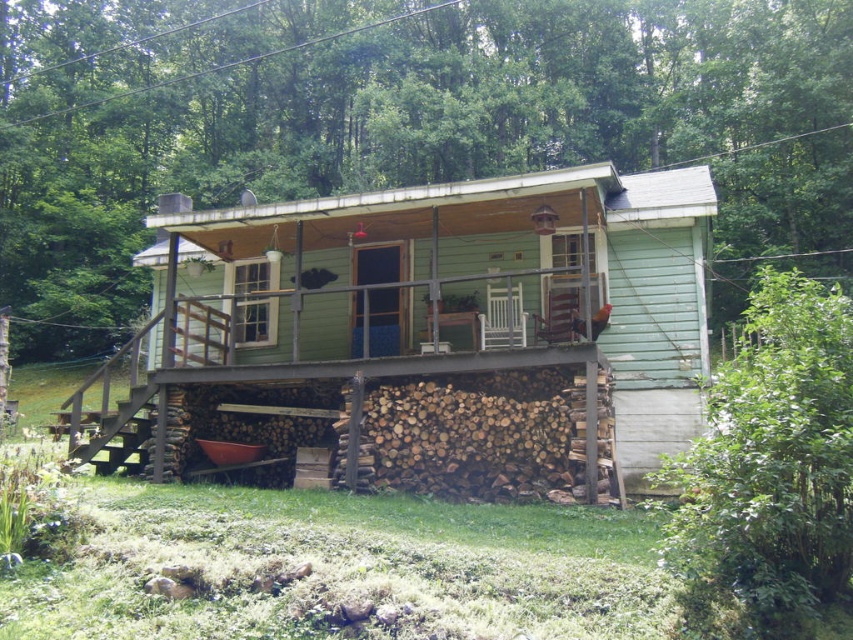
Question: Does green wooden cabin at center appear over green wooden porch at center?

Choices:
 (A) yes
 (B) no

Answer: (B)

Question: Does green wooden cabin at center lie in front of green wooden porch at center?

Choices:
 (A) yes
 (B) no

Answer: (B)

Question: Which object is farther from the camera taking this photo?

Choices:
 (A) green wooden porch at center
 (B) green wooden cabin at center

Answer: (B)

Question: Can you confirm if green wooden cabin at center is positioned above green wooden porch at center?

Choices:
 (A) no
 (B) yes

Answer: (A)